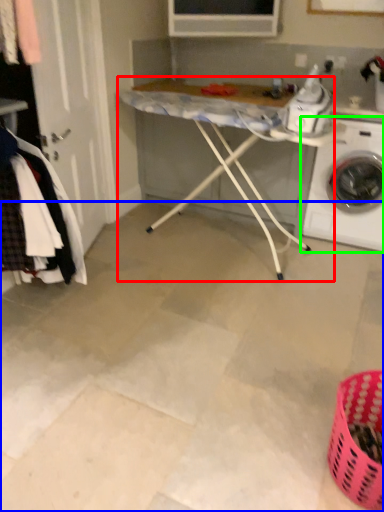
Question: Considering the real-world distances, which object is farthest from table (highlighted by a red box)? concrete (highlighted by a blue box) or washing machine (highlighted by a green box)?

Choices:
 (A) concrete
 (B) washing machine

Answer: (A)